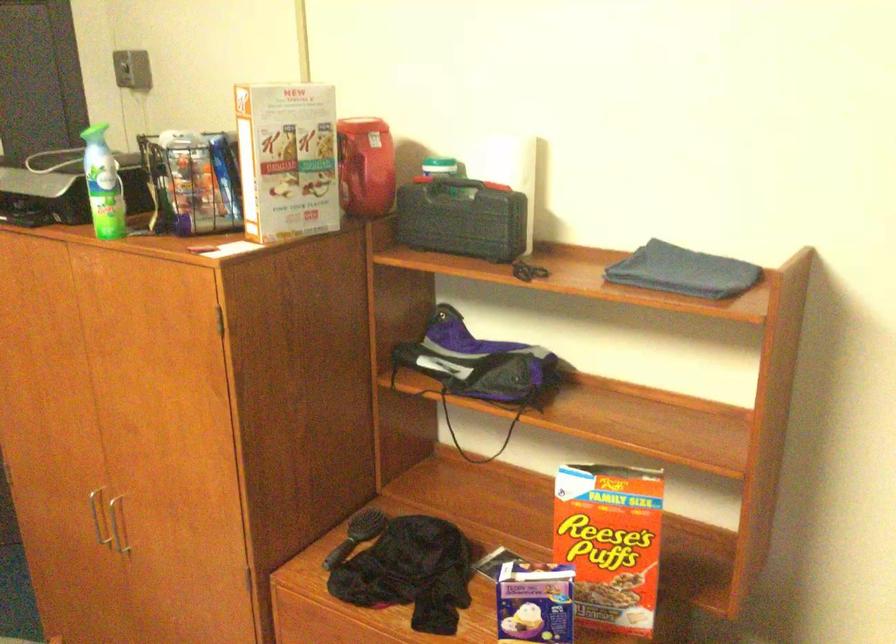
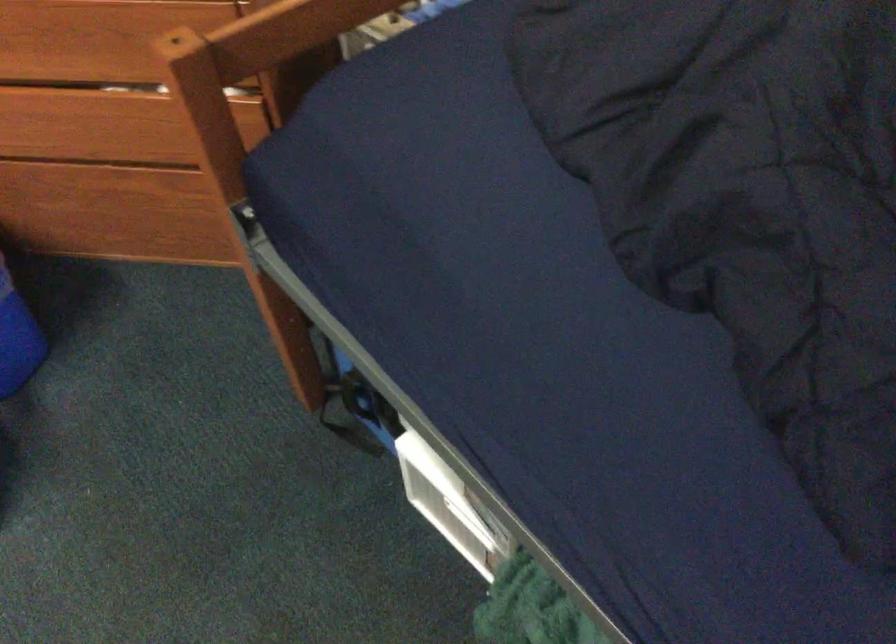
Based on the continuous images, in which direction is the camera rotating?

The camera's rotation is toward right-down.